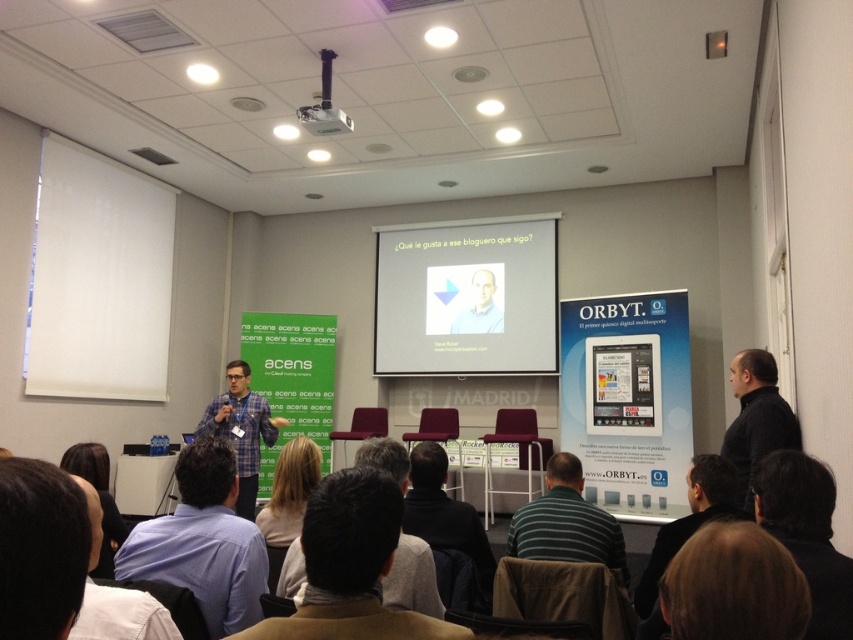
Question: Does dark gray jacket at lower center have a larger size compared to brown hair at lower left?

Choices:
 (A) yes
 (B) no

Answer: (B)

Question: Which object is positioned farthest from the brown woolen sweater at lower center?

Choices:
 (A) dark hair at lower right
 (B) dark gray sweater at lower right
 (C) matte white man at center
 (D) blonde hair at center

Answer: (C)

Question: Which point is farther to the camera?

Choices:
 (A) (445, 296)
 (B) (346, 538)
 (C) (335, 129)
 (D) (225, 426)

Answer: (A)

Question: Can you confirm if dark hair at lower right is smaller than black matte jacket at right?

Choices:
 (A) no
 (B) yes

Answer: (B)

Question: Which point appears farthest from the camera in this image?

Choices:
 (A) (231, 573)
 (B) (468, 310)

Answer: (B)

Question: Can you confirm if plaid shirt at center is positioned to the left of brown hair at lower left?

Choices:
 (A) yes
 (B) no

Answer: (A)